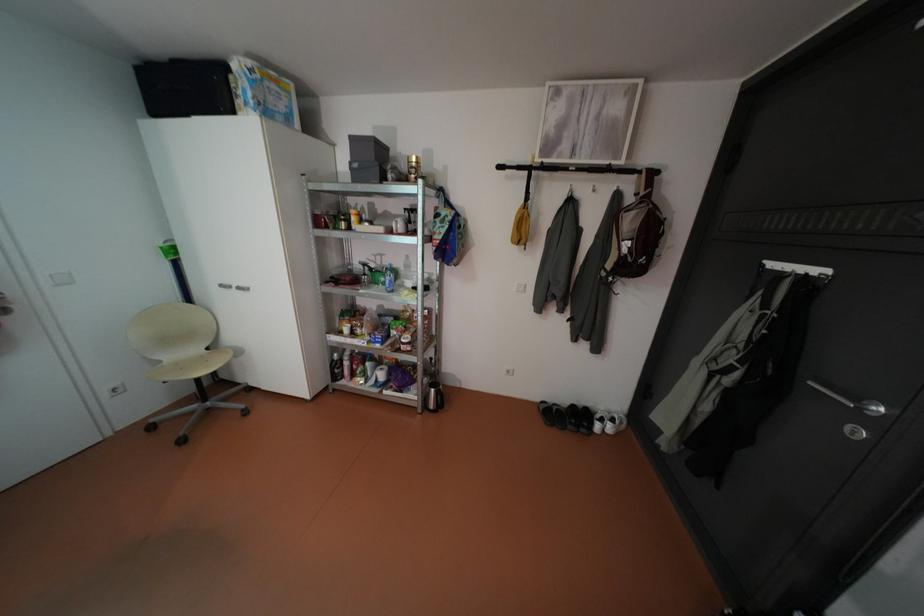
I want to click on silver door handle, so click(x=854, y=410).